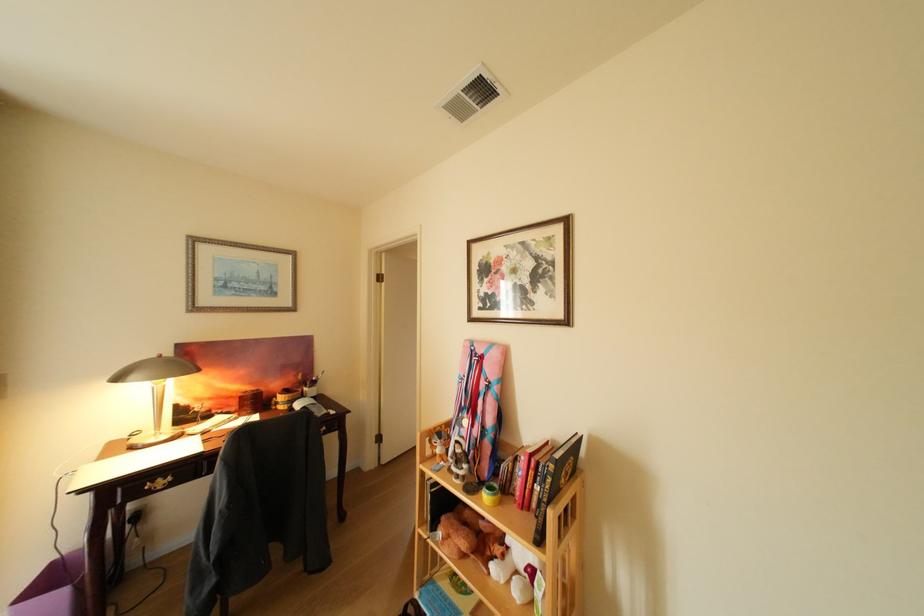
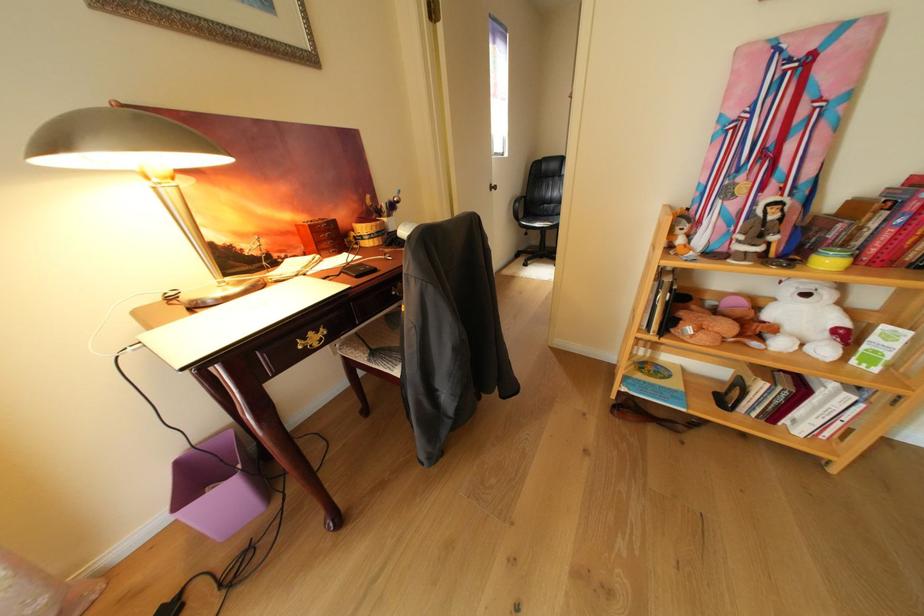
The point at (446,444) is marked in the first image. Where is the corresponding point in the second image?

(689, 230)